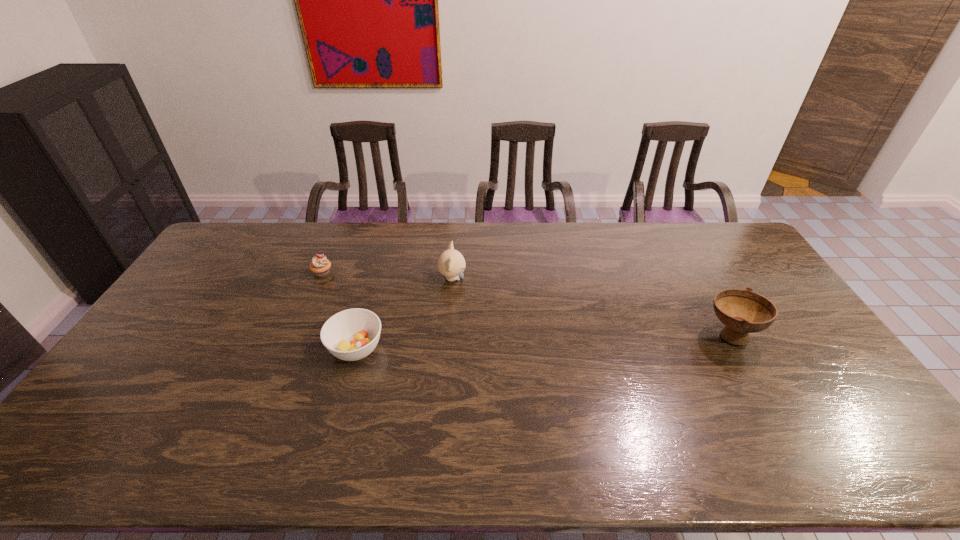
Identify the location of free space that satisfies the following two spatial constraints: 1. on the face of the rightmost object; 2. on the left side of the kitten. (448, 335).

You are a GUI agent. You are given a task and a screenshot of the screen. Output one action in this format:
    pyautogui.click(x=<x>, y=<y>)
    Task: Click on the free location that satisfies the following two spatial constraints: 1. on the back side of the rightmost object; 2. on the face of the third object from left to right
    The width and height of the screenshot is (960, 540).
    Given the screenshot: What is the action you would take?
    pyautogui.click(x=698, y=279)

You are a GUI agent. You are given a task and a screenshot of the screen. Output one action in this format:
    pyautogui.click(x=<x>, y=<y>)
    Task: Click on the free space that satisfies the following two spatial constraints: 1. on the face of the kitten; 2. on the front side of the second object from left to right
    
    Given the screenshot: What is the action you would take?
    pyautogui.click(x=447, y=348)

This screenshot has width=960, height=540. In order to click on free space that satisfies the following two spatial constraints: 1. on the front side of the leftmost object; 2. on the left side of the shorter soup bowl in this screenshot , I will do `click(291, 348)`.

The height and width of the screenshot is (540, 960). I want to click on vacant space that satisfies the following two spatial constraints: 1. on the front side of the leftmost object; 2. on the right side of the rightmost object, so click(x=296, y=335).